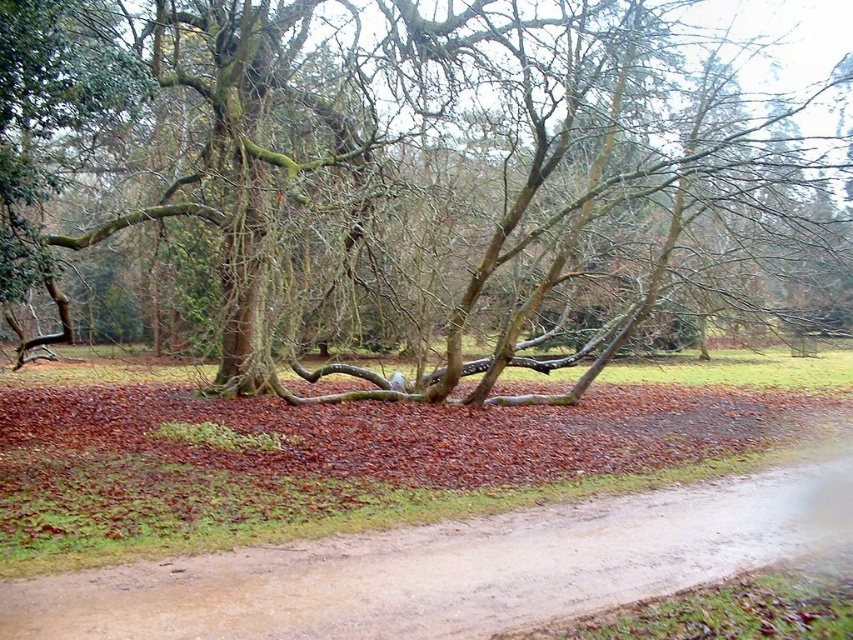
You are a hiker carrying a backpack and want to take a photo of both the green mossy tree trunk at center and the dirt road at center in the same frame. Can you stand at a position where both objects are visible without moving your camera? Explain your reasoning.

The green mossy tree trunk at center and dirt road at center are 30.74 feet apart from each other. Since the distance between them is relatively large, you can likely find a vantage point where both are within the camera frame by positioning yourself at a sufficient distance from both objects. This allows the camera to capture both the tree trunk and the dirt road in the same shot without needing to move the camera.

You are standing on the dirt road at center and want to walk towards the green mossy tree trunk at center. Which direction should you face to walk directly towards it?

The green mossy tree trunk at center is positioned on the left side of dirt road at center, so you should face to the left to walk directly towards it.

You are a hiker trying to determine if your 1.5 meter wide tent can be placed along the dirt road at center without touching the green mossy tree trunk at center. Can you fit your tent there?

The green mossy tree trunk at center might be wider than the dirt road at center, so the width of the dirt road at center is uncertain. Therefore, it is possible that the tent may not fit safely without encroaching on the tree trunk. It would be safer to measure the actual width before placing the tent.